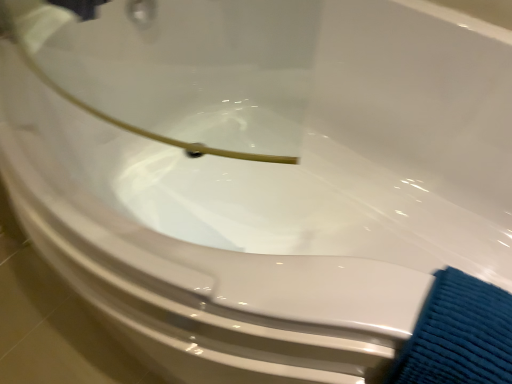
What do you see at coordinates (458, 335) in the screenshot? I see `blue textured towel at lower right` at bounding box center [458, 335].

Where is `blue textured towel at lower right`? blue textured towel at lower right is located at coordinates (458, 335).

Identify the location of blue textured towel at lower right. The image size is (512, 384). (458, 335).